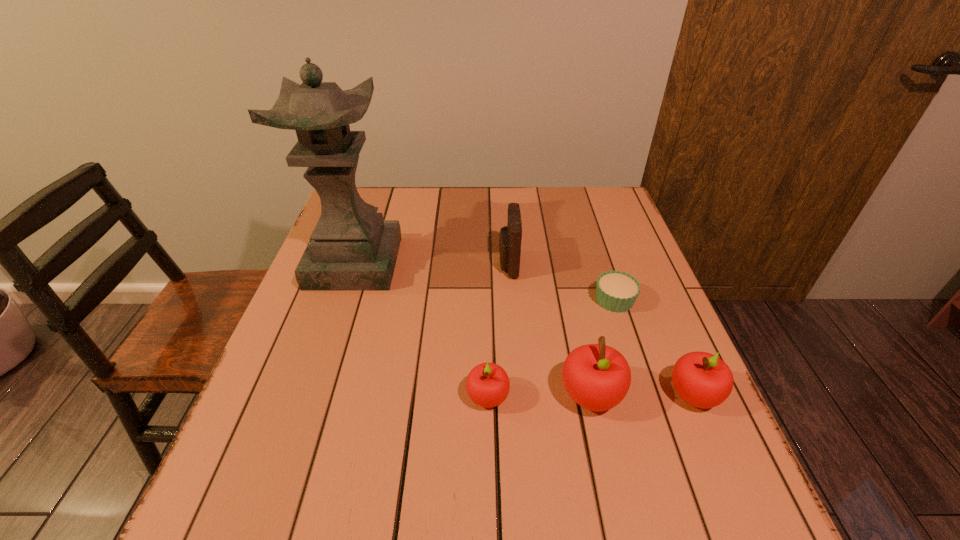
This screenshot has width=960, height=540. I want to click on vacant space that is in between the leftmost object and the rightmost apple, so click(x=524, y=329).

This screenshot has height=540, width=960. What are the coordinates of `empty space between the rightmost apple and the sculpture` in the screenshot? It's located at pos(524,329).

The width and height of the screenshot is (960, 540). I want to click on free spot between the tallest apple and the pouch, so click(x=549, y=330).

Where is `vacant area that lies between the second tallest apple and the tallest apple`? vacant area that lies between the second tallest apple and the tallest apple is located at coordinates (642, 395).

Find the location of a particular element. The image size is (960, 540). the third closest object to the cupcake is located at coordinates (510, 236).

Locate an element on the screen. The image size is (960, 540). object that is the third closest to the shortest apple is located at coordinates click(510, 236).

Identify which apple is the nearest to the shortest apple. Please provide its 2D coordinates. Your answer should be formatted as a tuple, i.e. [(x, y)], where the tuple contains the x and y coordinates of a point satisfying the conditions above.

[(597, 377)]

Identify the location of apple that is the second closest to the shortest object. (703, 380).

Find the location of `blank space that satisfies the following two spatial constraints: 1. at the front opening of the second shortest object; 2. on the right side of the tallest object`. blank space that satisfies the following two spatial constraints: 1. at the front opening of the second shortest object; 2. on the right side of the tallest object is located at coordinates (309, 397).

What are the coordinates of `free spot that satisfies the following two spatial constraints: 1. on the front side of the rightmost apple; 2. on the left side of the cupcake` in the screenshot? It's located at (646, 395).